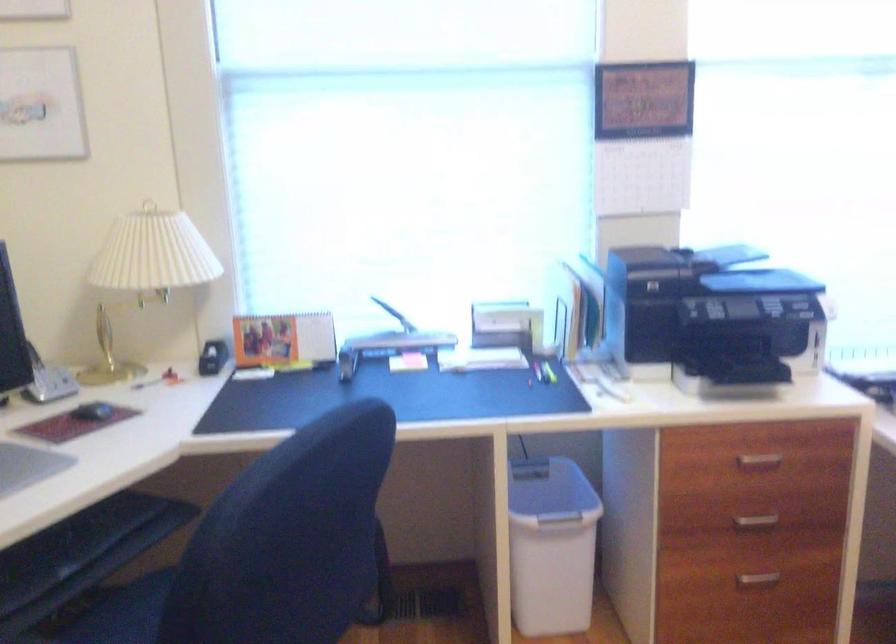
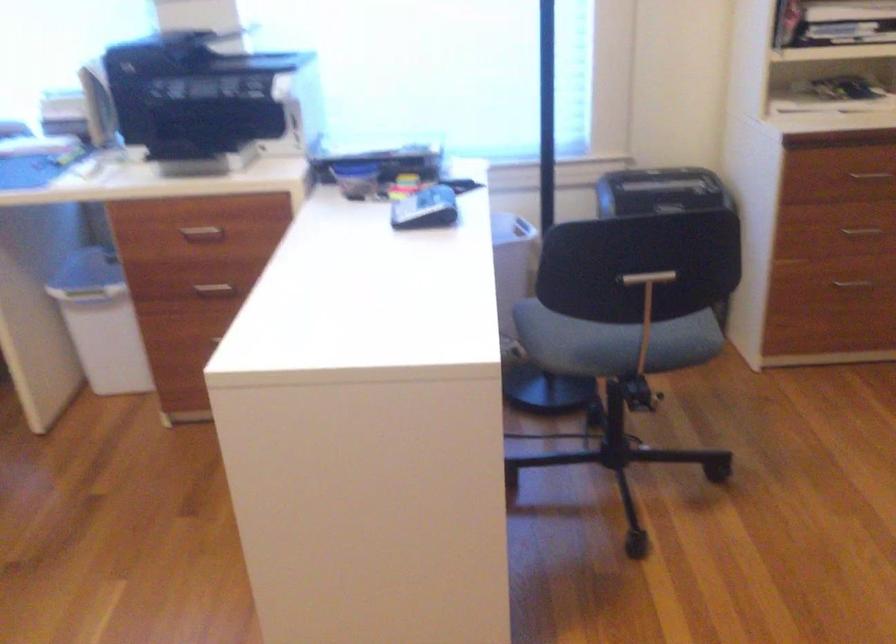
Question: Which direction would the cameraman need to move to produce the second image? Reply with the corresponding letter.

Choices:
 (A) Left
 (B) Right
 (C) Forward
 (D) Backward

Answer: (B)